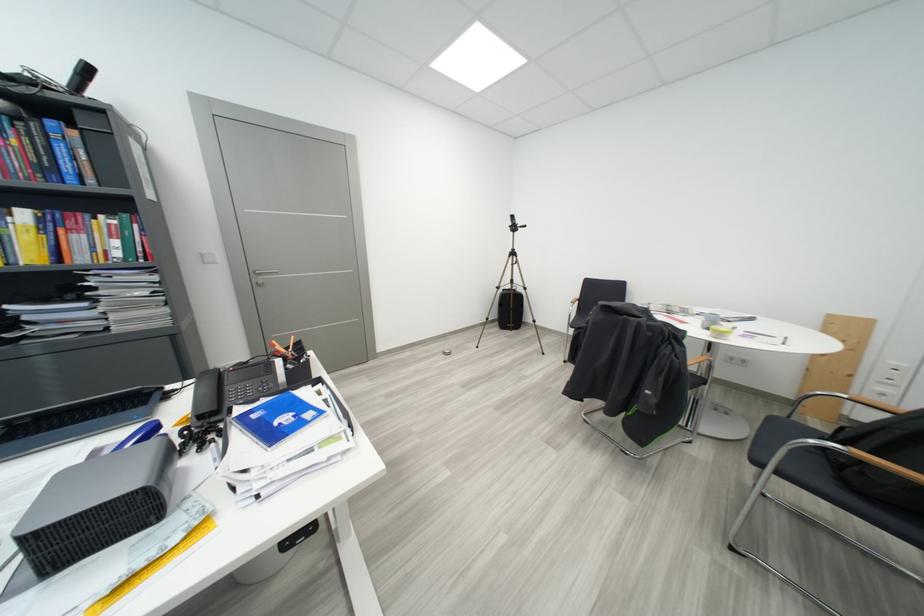
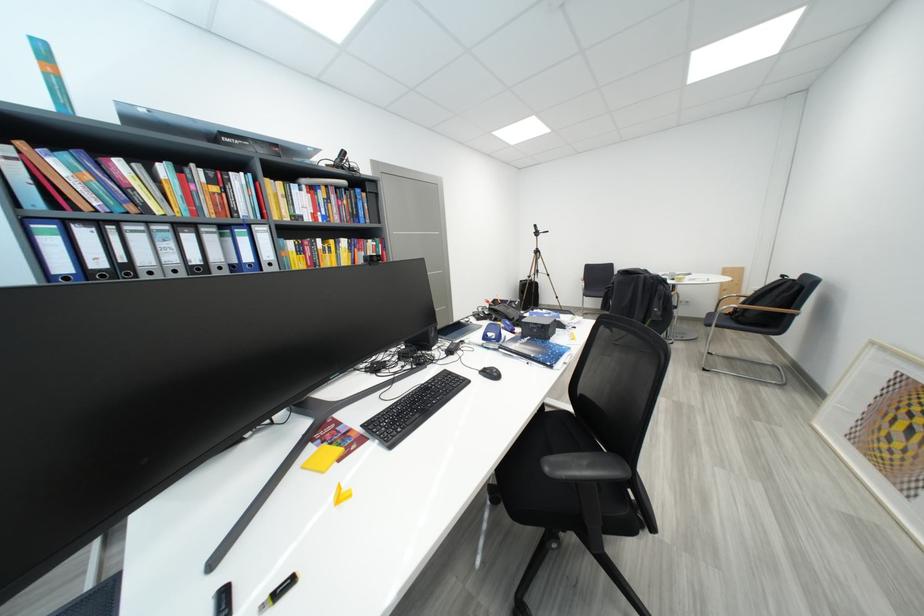
The point at (856, 487) is marked in the first image. Where is the corresponding point in the second image?

(748, 325)